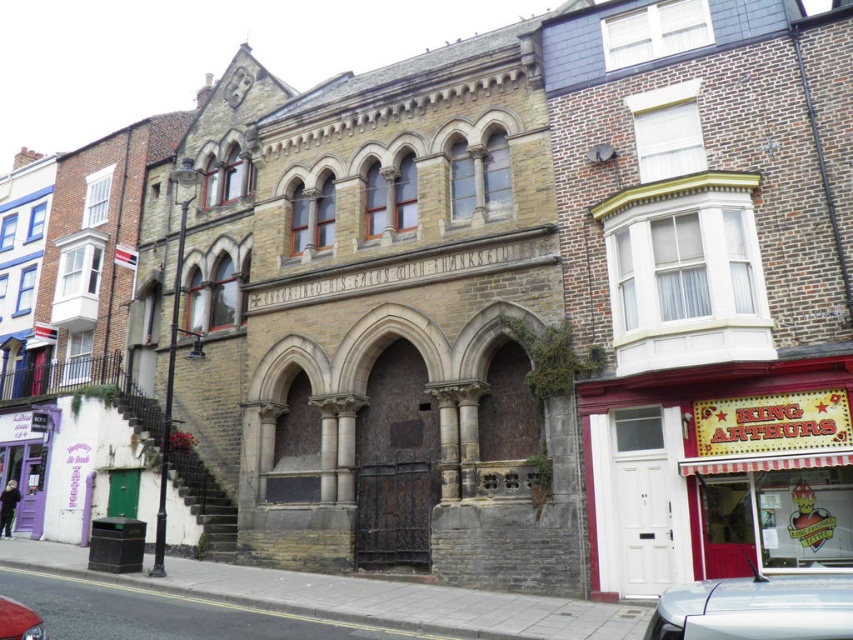
Is red striped awning at lower right above silver metallic car at lower right?

Yes, red striped awning at lower right is above silver metallic car at lower right.

Can you confirm if red striped awning at lower right is positioned to the left of silver metallic car at lower right?

In fact, red striped awning at lower right is to the right of silver metallic car at lower right.

Does point (622, 582) lie in front of point (801, 600)?

No, it is not.

This screenshot has width=853, height=640. I want to click on red striped awning at lower right, so click(717, 470).

Between point (798, 636) and point (4, 596), which one is positioned behind?

Point (4, 596)

Can you confirm if silver metallic car at lower right is positioned above shiny red car at lower left?

No, silver metallic car at lower right is not above shiny red car at lower left.

Between point (790, 620) and point (1, 595), which one is positioned behind?

The point (1, 595) is more distant.

Where is `silver metallic car at lower right`? The width and height of the screenshot is (853, 640). silver metallic car at lower right is located at coordinates (756, 608).

Who is positioned more to the left, red striped awning at lower right or shiny red car at lower left?

shiny red car at lower left

Between red striped awning at lower right and shiny red car at lower left, which one is positioned lower?

shiny red car at lower left is lower down.

Identify the location of red striped awning at lower right. (717, 470).

This screenshot has width=853, height=640. I want to click on red striped awning at lower right, so click(x=717, y=470).